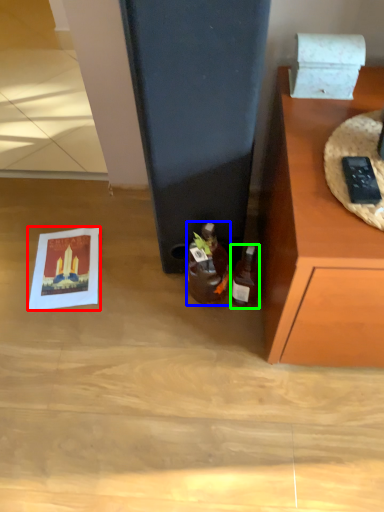
Question: Which is nearer to the postcard (highlighted by a red box)? bottle (highlighted by a blue box) or bottle (highlighted by a green box).

Choices:
 (A) bottle
 (B) bottle

Answer: (A)